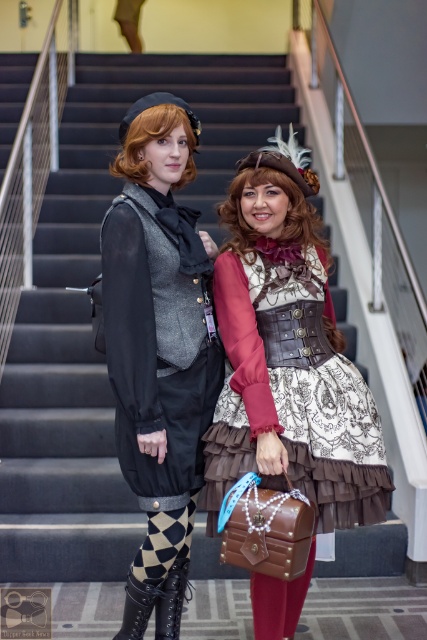
Question: Which point is farther to the camera?

Choices:
 (A) white lace dress at center
 (B) matte black dress at center
 (C) black leather boot at lower left

Answer: (C)

Question: Which of the following is the closest to the observer?

Choices:
 (A) matte black dress at center
 (B) matte black vest at center
 (C) black leather boot at lower center
 (D) white lace dress at center

Answer: (A)

Question: Is matte black vest at center thinner than white lace dress at center?

Choices:
 (A) no
 (B) yes

Answer: (B)

Question: Is matte black dress at center positioned at the back of matte black vest at center?

Choices:
 (A) yes
 (B) no

Answer: (B)

Question: Observing the image, what is the correct spatial positioning of matte black dress at center in reference to black leather boot at lower left?

Choices:
 (A) above
 (B) below

Answer: (A)

Question: Which point is farther to the camera?

Choices:
 (A) black leather boot at lower left
 (B) matte black vest at center
 (C) matte black dress at center
 (D) black leather boot at lower center

Answer: (D)